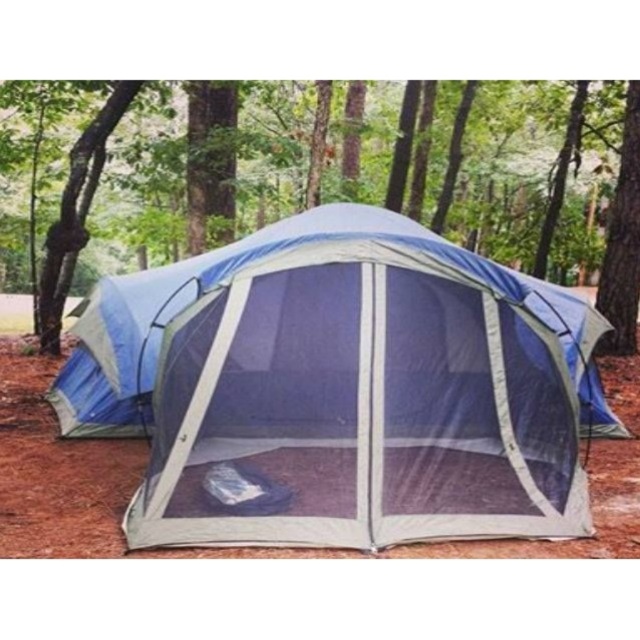
Can you confirm if blue mesh tent at center is shorter than brown rough bark tree at right?

Yes, blue mesh tent at center is shorter than brown rough bark tree at right.

Is blue mesh tent at center bigger than brown rough bark tree at right?

Correct, blue mesh tent at center is larger in size than brown rough bark tree at right.

The width and height of the screenshot is (640, 640). I want to click on blue mesh tent at center, so click(x=244, y=262).

Can you confirm if green textured bark at center is taller than blue mesh tent at center?

Indeed, green textured bark at center has a greater height compared to blue mesh tent at center.

Between green textured bark at center and blue mesh tent at center, which one appears on the left side from the viewer's perspective?

Positioned to the left is green textured bark at center.

Between point (161, 176) and point (282, 220), which one is positioned in front?

Positioned in front is point (282, 220).

Image resolution: width=640 pixels, height=640 pixels. Find the location of `green textured bark at center`. green textured bark at center is located at coordinates (506, 170).

The height and width of the screenshot is (640, 640). What do you see at coordinates (506, 170) in the screenshot? I see `green textured bark at center` at bounding box center [506, 170].

Which is in front, point (588, 268) or point (634, 340)?

Point (634, 340)

The image size is (640, 640). In order to click on green textured bark at center in this screenshot , I will do `click(506, 170)`.